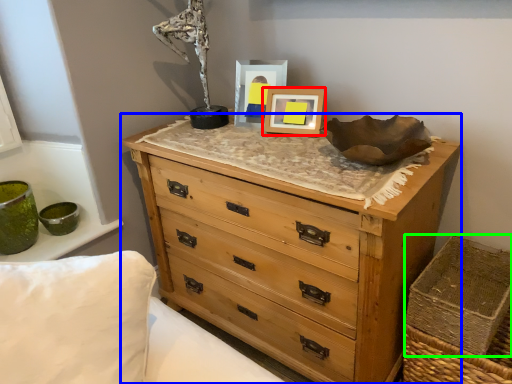
Question: Which is farther away from picture frame (highlighted by a red box)? chest of drawers (highlighted by a blue box) or crate (highlighted by a green box)?

Choices:
 (A) chest of drawers
 (B) crate

Answer: (B)